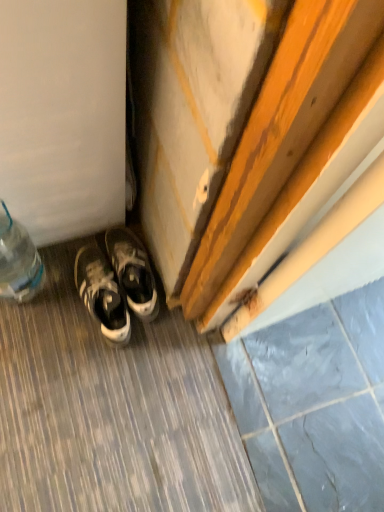
Locate an element on the screen. white leather sneakers at lower left is located at coordinates (116, 283).

Describe the element at coordinates (314, 404) in the screenshot. Image resolution: width=384 pixels, height=512 pixels. I see `gray stone tile at lower right` at that location.

Locate an element on the screen. white leather sneakers at lower left is located at coordinates (116, 283).

Which object is more forward, clear plastic bottle at lower left or white leather sneakers at lower left?

clear plastic bottle at lower left is in front.

In the scene shown: How many degrees apart are the facing directions of clear plastic bottle at lower left and white leather sneakers at lower left?

There is a 79.8-degree angle between the facing directions of clear plastic bottle at lower left and white leather sneakers at lower left.

Would you consider clear plastic bottle at lower left to be distant from white leather sneakers at lower left?

clear plastic bottle at lower left is near white leather sneakers at lower left, not far away.

Does clear plastic bottle at lower left turn towards white leather sneakers at lower left?

No, clear plastic bottle at lower left is not aimed at white leather sneakers at lower left.

From a real-world perspective, which is physically below, white leather sneakers at lower left or white leather sneakers at lower left?

In real-world perspective, white leather sneakers at lower left is lower.

Which object is positioned more to the left, white leather sneakers at lower left or white leather sneakers at lower left?

white leather sneakers at lower left is more to the left.

At what (x,y) coordinates should I click in order to perform the action: click on sneakers behind the white leather sneakers at lower left. Please return your answer as a coordinate pair (x, y). Looking at the image, I should click on click(x=133, y=271).

Considering the sizes of white leather sneakers at lower left and white leather sneakers at lower left in the image, is white leather sneakers at lower left taller or shorter than white leather sneakers at lower left?

Clearly, white leather sneakers at lower left is taller compared to white leather sneakers at lower left.

Consider the image. Is white leather sneakers at lower left not inside gray stone tile at lower right?

Yes.

From the image's perspective, is white leather sneakers at lower left above or below gray stone tile at lower right?

white leather sneakers at lower left is above gray stone tile at lower right.

Between white leather sneakers at lower left and gray stone tile at lower right, which one appears on the left side from the viewer's perspective?

white leather sneakers at lower left is more to the left.

How many degrees apart are the facing directions of white leather sneakers at lower left and gray stone tile at lower right?

78.3 degrees separate the facing orientations of white leather sneakers at lower left and gray stone tile at lower right.

Is clear plastic bottle at lower left positioned with its back to gray stone tile at lower right?

clear plastic bottle at lower left does not have its back to gray stone tile at lower right.

Consider the image. Measure the distance between clear plastic bottle at lower left and gray stone tile at lower right.

clear plastic bottle at lower left and gray stone tile at lower right are 30.49 inches apart.

Consider the image. Which object is closer to the camera taking this photo, clear plastic bottle at lower left or gray stone tile at lower right?

clear plastic bottle at lower left is more forward.

Is clear plastic bottle at lower left with gray stone tile at lower right?

There is a gap between clear plastic bottle at lower left and gray stone tile at lower right.

Is the position of gray stone tile at lower right less distant than that of white leather sneakers at lower left?

Yes, the depth of gray stone tile at lower right is less than that of white leather sneakers at lower left.

Is gray stone tile at lower right next to white leather sneakers at lower left and touching it?

No, gray stone tile at lower right is not making contact with white leather sneakers at lower left.

Can you confirm if gray stone tile at lower right is taller than white leather sneakers at lower left?

No, gray stone tile at lower right is not taller than white leather sneakers at lower left.

Measure the distance from gray stone tile at lower right to clear plastic bottle at lower left.

30.49 inches.

From a real-world perspective, is gray stone tile at lower right physically above clear plastic bottle at lower left?

No, from a real-world perspective, gray stone tile at lower right is not above clear plastic bottle at lower left.

Is gray stone tile at lower right inside or outside of clear plastic bottle at lower left?

gray stone tile at lower right lies outside clear plastic bottle at lower left.

Is point (233, 348) farther from viewer compared to point (1, 223)?

Yes, point (233, 348) is farther from viewer.

You are a GUI agent. You are given a task and a screenshot of the screen. Output one action in this format:
    pyautogui.click(x=<x>, y=<y>)
    Task: Click on the footwear below the clear plastic bottle at lower left (from the image's perspective)
    The image size is (384, 512).
    Given the screenshot: What is the action you would take?
    pyautogui.click(x=116, y=283)

How distant is clear plastic bottle at lower left from white leather sneakers at lower left?

clear plastic bottle at lower left is 7.91 inches away from white leather sneakers at lower left.

Is point (11, 272) farther from camera compared to point (126, 291)?

No, it is in front of (126, 291).

I want to click on sneakers lying behind the clear plastic bottle at lower left, so click(x=133, y=271).

Where is `sneakers above the white leather sneakers at lower left (from the image's perspective)`? Image resolution: width=384 pixels, height=512 pixels. sneakers above the white leather sneakers at lower left (from the image's perspective) is located at coordinates (133, 271).

Based on their spatial positions, is clear plastic bottle at lower left or white leather sneakers at lower left closer to white leather sneakers at lower left?

Among the two, white leather sneakers at lower left is located nearer to white leather sneakers at lower left.

Based on their spatial positions, is white leather sneakers at lower left or gray stone tile at lower right closer to clear plastic bottle at lower left?

The object closer to clear plastic bottle at lower left is white leather sneakers at lower left.

From the image, which object appears to be nearer to gray stone tile at lower right, white leather sneakers at lower left or white leather sneakers at lower left?

white leather sneakers at lower left lies closer to gray stone tile at lower right than the other object.

Estimate the real-world distances between objects in this image. Which object is further from white leather sneakers at lower left, gray stone tile at lower right or clear plastic bottle at lower left?

gray stone tile at lower right.

Considering their positions, is clear plastic bottle at lower left positioned closer to white leather sneakers at lower left than gray stone tile at lower right?

Among the two, clear plastic bottle at lower left is located nearer to white leather sneakers at lower left.

From the image, which object appears to be nearer to clear plastic bottle at lower left, white leather sneakers at lower left or gray stone tile at lower right?

white leather sneakers at lower left is positioned closer to the anchor clear plastic bottle at lower left.

Based on their spatial positions, is clear plastic bottle at lower left or gray stone tile at lower right closer to white leather sneakers at lower left?

Based on the image, clear plastic bottle at lower left appears to be nearer to white leather sneakers at lower left.

Which object lies further to the anchor point clear plastic bottle at lower left, white leather sneakers at lower left or white leather sneakers at lower left?

white leather sneakers at lower left lies further to clear plastic bottle at lower left than the other object.

This screenshot has height=512, width=384. I want to click on footwear between clear plastic bottle at lower left and white leather sneakers at lower left, so click(116, 283).

The height and width of the screenshot is (512, 384). Identify the location of sneakers located between white leather sneakers at lower left and gray stone tile at lower right in the left-right direction. (133, 271).

Locate an element on the screen. footwear between clear plastic bottle at lower left and gray stone tile at lower right in the horizontal direction is located at coordinates (116, 283).

Locate an element on the screen. sneakers between clear plastic bottle at lower left and gray stone tile at lower right is located at coordinates (133, 271).